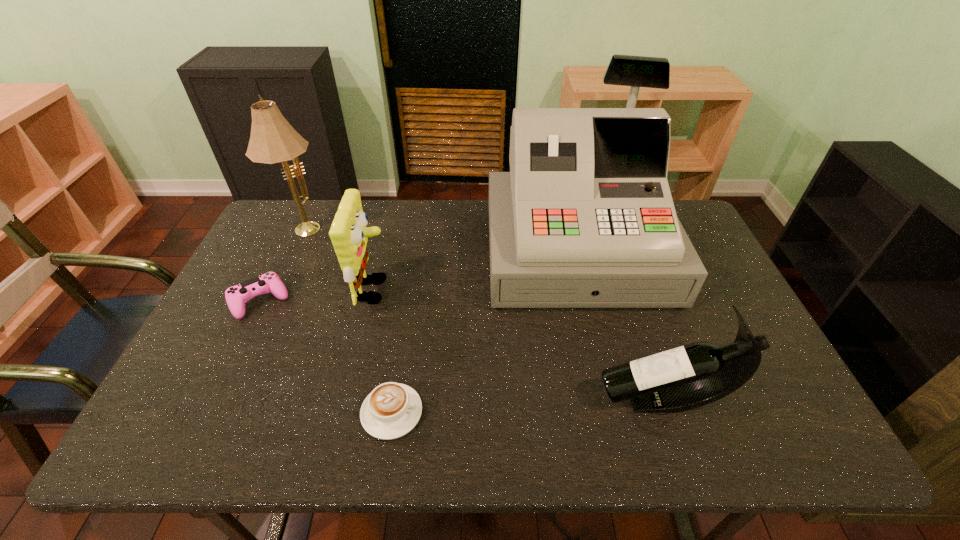
At what (x,y) coordinates should I click in order to perform the action: click on free region located 0.380m on the stand of the wine bottle. Please return your answer as a coordinate pair (x, y). Looking at the image, I should click on (433, 399).

I want to click on vacant space located 0.130m on the stand of the wine bottle, so click(540, 399).

Find the location of a particular element. The height and width of the screenshot is (540, 960). vacant space located 0.170m on the right of the control is located at coordinates (348, 301).

You are a GUI agent. You are given a task and a screenshot of the screen. Output one action in this format:
    pyautogui.click(x=<x>, y=<y>)
    Task: Click on the free space located 0.330m with the handle on the right side of the cappuccino
    The height and width of the screenshot is (540, 960).
    Given the screenshot: What is the action you would take?
    pyautogui.click(x=567, y=412)

This screenshot has width=960, height=540. Identify the location of cash register present at the far edge. (585, 218).

Where is `lampshade that is positioned at the far edge`? lampshade that is positioned at the far edge is located at coordinates (273, 140).

At what (x,y) coordinates should I click in order to perform the action: click on wine bottle present at the near edge. Please return your answer as a coordinate pair (x, y). This screenshot has height=540, width=960. Looking at the image, I should click on (690, 376).

Find the location of a particular element. The height and width of the screenshot is (540, 960). cappuccino present at the near edge is located at coordinates (391, 410).

I want to click on lampshade at the left edge, so click(273, 140).

Find the location of a particular element. control located at the left edge is located at coordinates (236, 296).